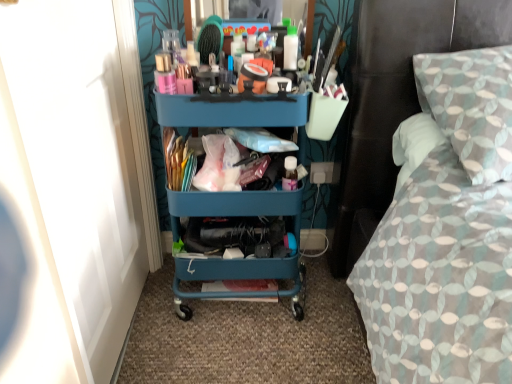
This screenshot has height=384, width=512. Find the location of `blank space situated above teal plastic cart at center (from a real-world perspective)`. blank space situated above teal plastic cart at center (from a real-world perspective) is located at coordinates (233, 83).